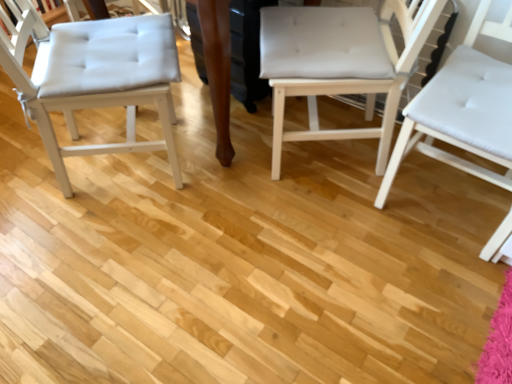
Question: Is white fabric chair at center, the second chair viewed from the left, positioned before white tufted cushion at left, arranged as the third chair when viewed from the right?

Choices:
 (A) yes
 (B) no

Answer: (B)

Question: Is white fabric chair at center, which appears as the second chair when viewed from the right, behind white tufted cushion at left, which is the 1th chair in left-to-right order?

Choices:
 (A) no
 (B) yes

Answer: (B)

Question: Does white fabric chair at center, the second chair viewed from the left, have a lesser width compared to white tufted cushion at left, arranged as the third chair when viewed from the right?

Choices:
 (A) no
 (B) yes

Answer: (B)

Question: Are white fabric chair at center, the second chair viewed from the left, and white tufted cushion at left, which is the 1th chair in left-to-right order, far apart?

Choices:
 (A) yes
 (B) no

Answer: (B)

Question: Is white fabric chair at center, the second chair viewed from the left, placed right next to white tufted cushion at left, which is the 1th chair in left-to-right order?

Choices:
 (A) no
 (B) yes

Answer: (A)

Question: Is point (118, 67) positioned closer to the camera than point (437, 152)?

Choices:
 (A) farther
 (B) closer

Answer: (B)

Question: Is white tufted cushion at left, which is the 1th chair in left-to-right order, spatially inside white leather chair at right, acting as the first chair starting from the right, or outside of it?

Choices:
 (A) outside
 (B) inside

Answer: (A)

Question: Considering their positions, is white tufted cushion at left, which is the 1th chair in left-to-right order, located in front of or behind white leather chair at right, placed as the 3th chair when sorted from left to right?

Choices:
 (A) front
 (B) behind

Answer: (B)

Question: From the image's perspective, relative to white leather chair at right, placed as the 3th chair when sorted from left to right, is white tufted cushion at left, arranged as the third chair when viewed from the right, above or below?

Choices:
 (A) above
 (B) below

Answer: (A)

Question: Which is correct: white tufted cushion at left, arranged as the third chair when viewed from the right, is inside white fabric chair at center, which appears as the second chair when viewed from the right, or outside of it?

Choices:
 (A) inside
 (B) outside

Answer: (B)

Question: Is white tufted cushion at left, which is the 1th chair in left-to-right order, in front of or behind white fabric chair at center, which appears as the second chair when viewed from the right, in the image?

Choices:
 (A) behind
 (B) front

Answer: (B)

Question: From a real-world perspective, is white tufted cushion at left, arranged as the third chair when viewed from the right, above or below white fabric chair at center, which appears as the second chair when viewed from the right?

Choices:
 (A) below
 (B) above

Answer: (B)

Question: In terms of size, does white tufted cushion at left, which is the 1th chair in left-to-right order, appear bigger or smaller than white fabric chair at center, the second chair viewed from the left?

Choices:
 (A) small
 (B) big

Answer: (B)

Question: From the image's perspective, is white leather chair at right, placed as the 3th chair when sorted from left to right, above or below white tufted cushion at left, arranged as the third chair when viewed from the right?

Choices:
 (A) below
 (B) above

Answer: (A)

Question: Is white leather chair at right, acting as the first chair starting from the right, wider or thinner than white tufted cushion at left, which is the 1th chair in left-to-right order?

Choices:
 (A) thin
 (B) wide

Answer: (A)